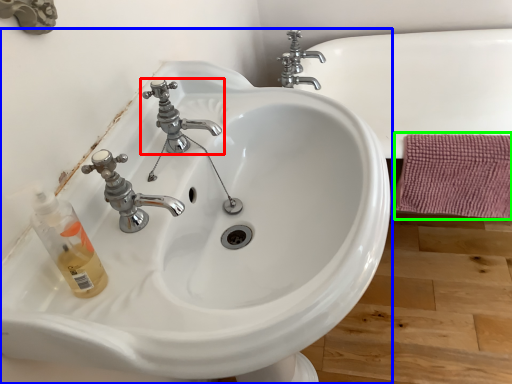
Question: Estimate the real-world distances between objects in this image. Which object is farther from tap (highlighted by a red box), sink (highlighted by a blue box) or bath towel (highlighted by a green box)?

Choices:
 (A) sink
 (B) bath towel

Answer: (B)